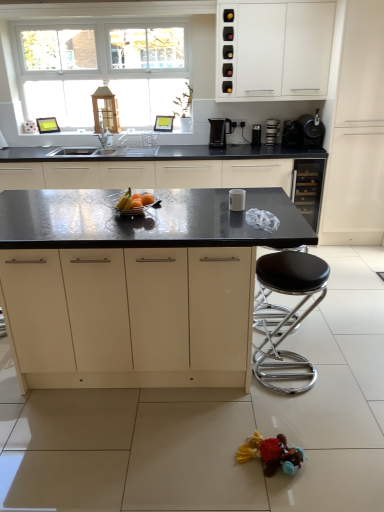
Question: Considering the relative positions of metallic silver bowl at center and multicolored fabric toy at lower right in the image provided, is metallic silver bowl at center to the left of multicolored fabric toy at lower right from the viewer's perspective?

Choices:
 (A) no
 (B) yes

Answer: (B)

Question: From the image's perspective, is metallic silver bowl at center located beneath multicolored fabric toy at lower right?

Choices:
 (A) yes
 (B) no

Answer: (B)

Question: Can you confirm if metallic silver bowl at center is wider than multicolored fabric toy at lower right?

Choices:
 (A) no
 (B) yes

Answer: (B)

Question: Considering the relative sizes of metallic silver bowl at center and multicolored fabric toy at lower right in the image provided, is metallic silver bowl at center smaller than multicolored fabric toy at lower right?

Choices:
 (A) yes
 (B) no

Answer: (A)

Question: Can you confirm if metallic silver bowl at center is thinner than multicolored fabric toy at lower right?

Choices:
 (A) yes
 (B) no

Answer: (B)

Question: Is metallic silver bowl at center shorter than multicolored fabric toy at lower right?

Choices:
 (A) yes
 (B) no

Answer: (A)

Question: Is black granite countertop at center, which appears as the first cabinetry when viewed from the left, positioned with its back to shiny metallic bowl at center?

Choices:
 (A) no
 (B) yes

Answer: (A)

Question: Is black granite countertop at center, marked as the 5th cabinetry in a right-to-left arrangement, wider than shiny metallic bowl at center?

Choices:
 (A) no
 (B) yes

Answer: (B)

Question: Considering the relative sizes of black granite countertop at center, which appears as the first cabinetry when viewed from the left, and shiny metallic bowl at center in the image provided, is black granite countertop at center, which appears as the first cabinetry when viewed from the left, shorter than shiny metallic bowl at center?

Choices:
 (A) no
 (B) yes

Answer: (A)

Question: Are black granite countertop at center, marked as the 5th cabinetry in a right-to-left arrangement, and shiny metallic bowl at center far apart?

Choices:
 (A) no
 (B) yes

Answer: (B)

Question: Considering the relative sizes of black granite countertop at center, which appears as the first cabinetry when viewed from the left, and shiny metallic bowl at center in the image provided, is black granite countertop at center, which appears as the first cabinetry when viewed from the left, thinner than shiny metallic bowl at center?

Choices:
 (A) no
 (B) yes

Answer: (A)

Question: Does black granite countertop at center, which appears as the first cabinetry when viewed from the left, contain shiny metallic bowl at center?

Choices:
 (A) no
 (B) yes

Answer: (A)

Question: From a real-world perspective, is matte white cabinet at right, marked as the 1th cabinetry in a right-to-left arrangement, physically below metallic silver coffee maker at upper right, acting as the 4th appliance starting from the bottom?

Choices:
 (A) yes
 (B) no

Answer: (B)